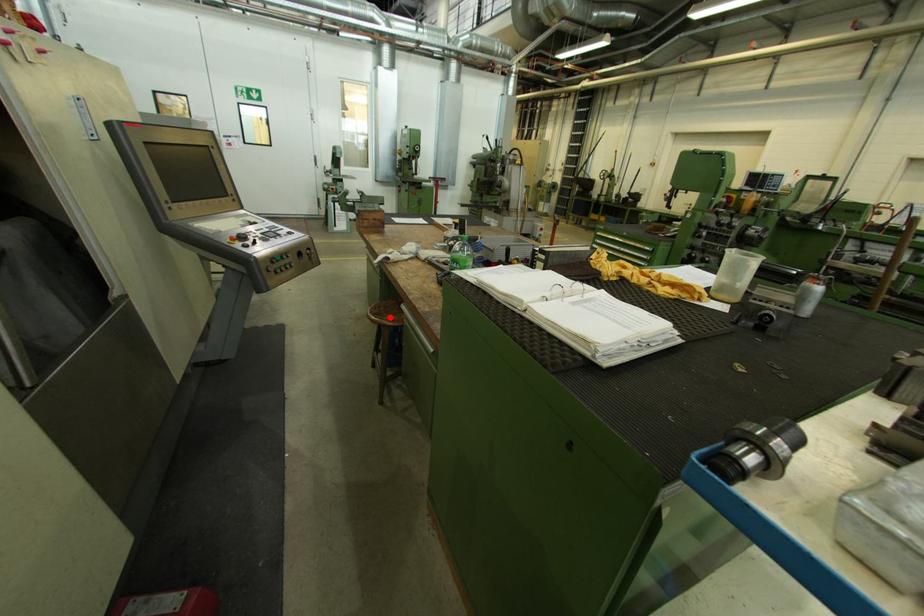
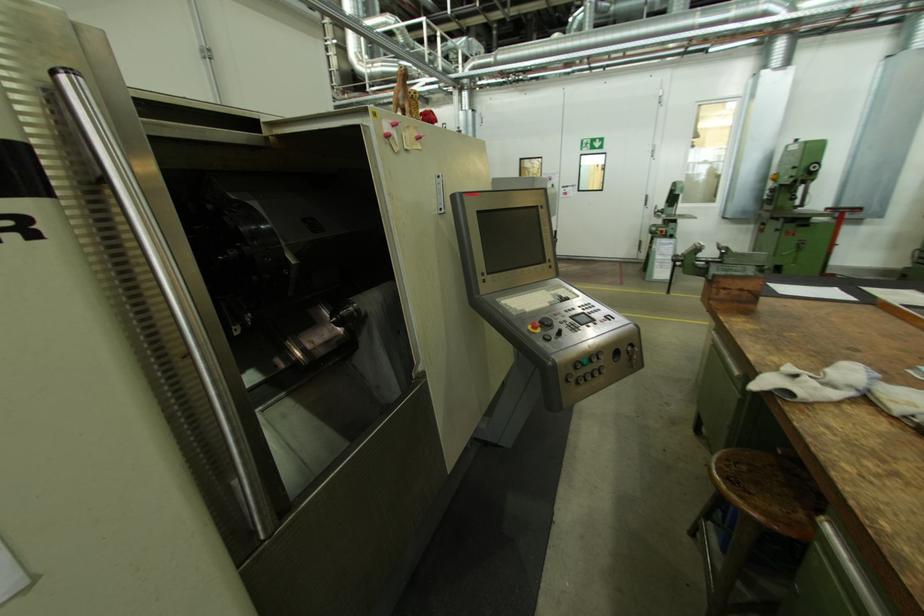
Question: A red point is marked in image1. In image2, is the corresponding 3D point closer to the camera or farther? Reply with the corresponding letter.

Choices:
 (A) The corresponding 3D point is closer.
 (B) The corresponding 3D point is farther.

Answer: (A)